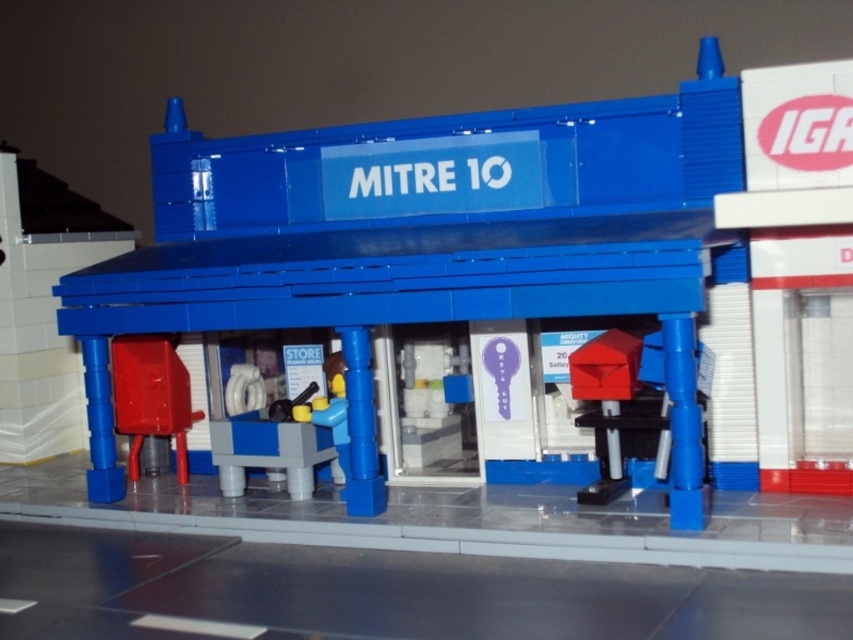
Question: Which object appears farthest from the camera in this image?

Choices:
 (A) matte blue toolbox at lower left
 (B) matte blue building at center
 (C) matte red toolbox at center
 (D) matte red mailbox at center

Answer: (A)

Question: Is the position of matte blue toolbox at lower left less distant than that of matte red mailbox at center?

Choices:
 (A) no
 (B) yes

Answer: (A)

Question: Does matte blue toolbox at lower left lie in front of smooth plastic water dispenser at center?

Choices:
 (A) no
 (B) yes

Answer: (A)

Question: Estimate the real-world distances between objects in this image. Which object is closer to the matte blue toolbox at lower left?

Choices:
 (A) matte red toolbox at center
 (B) matte red mailbox at center

Answer: (A)

Question: Which object appears closest to the camera in this image?

Choices:
 (A) matte blue toolbox at lower left
 (B) matte red mailbox at center

Answer: (B)

Question: Is matte red toolbox at center further to camera compared to smooth plastic water dispenser at center?

Choices:
 (A) yes
 (B) no

Answer: (A)